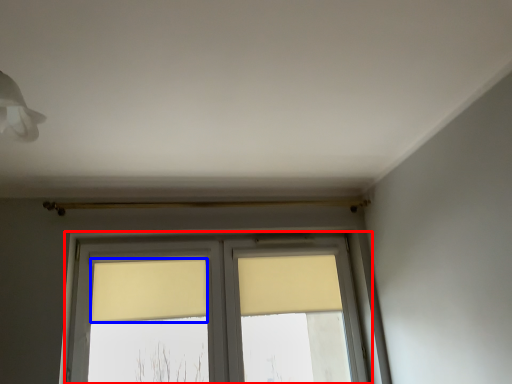
Question: Which object is further to the camera taking this photo, window (highlighted by a red box) or curtain (highlighted by a blue box)?

Choices:
 (A) window
 (B) curtain

Answer: (B)